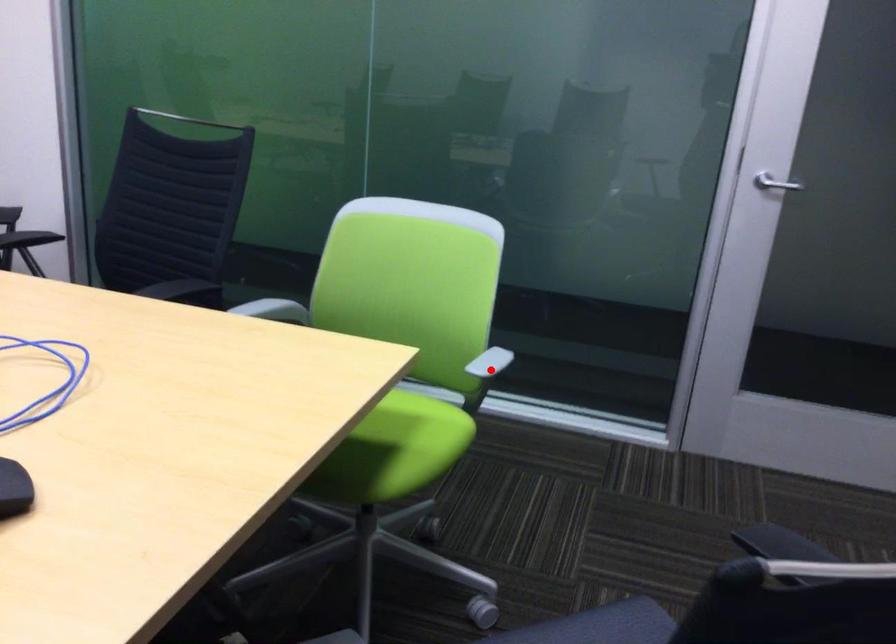
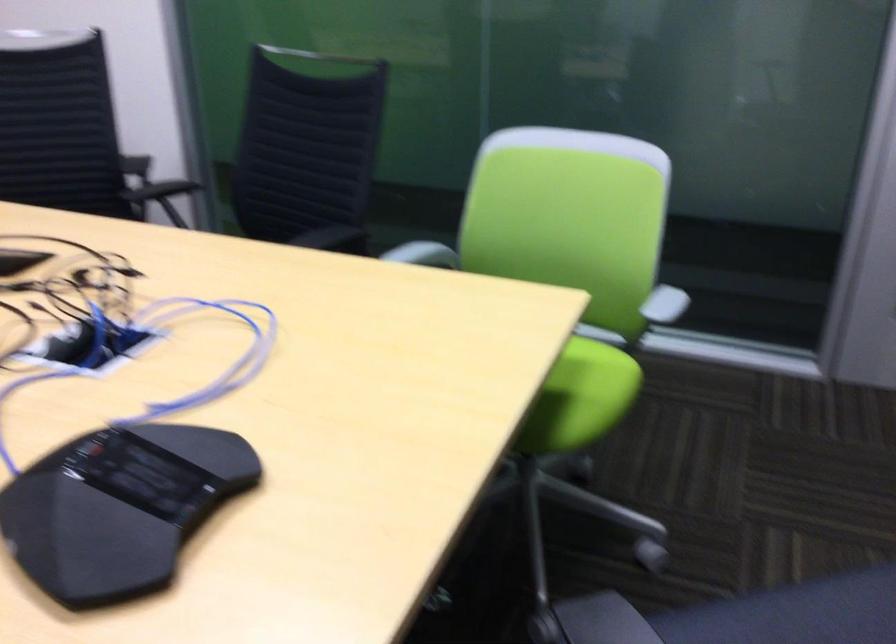
Locate, in the second image, the point that corresponds to the highlighted location in the first image.

(659, 310)